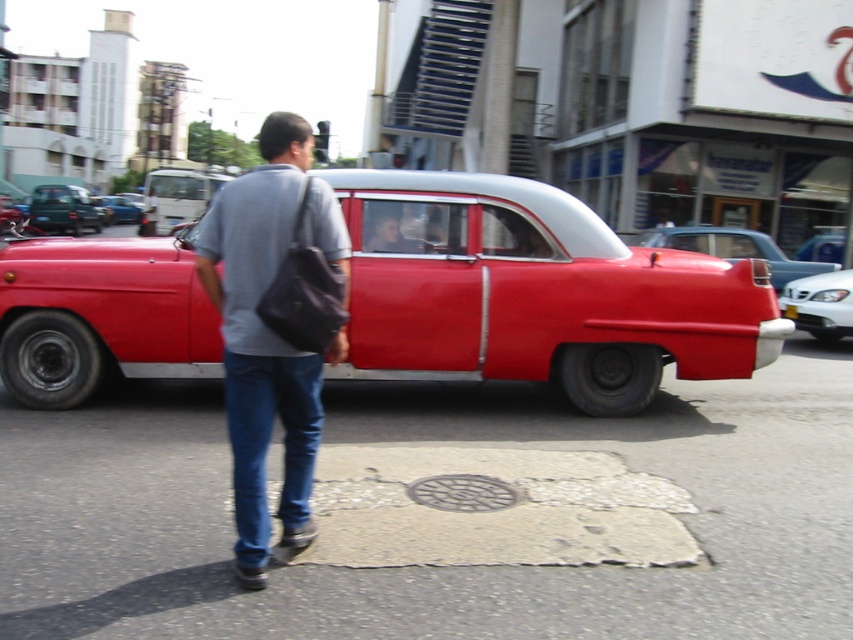
Question: Can you confirm if white glossy sedan at center is thinner than metallic blue car at center?

Choices:
 (A) no
 (B) yes

Answer: (B)

Question: Which object is farther from the camera taking this photo?

Choices:
 (A) shiny red car at center
 (B) white plastic license plate at center
 (C) white glossy sedan at center

Answer: (B)

Question: Does white glossy sedan at center have a greater width compared to metallic blue car at center?

Choices:
 (A) no
 (B) yes

Answer: (A)

Question: Among these points, which one is farthest from the camera?

Choices:
 (A) (796, 314)
 (B) (834, 292)
 (C) (119, 214)

Answer: (C)

Question: Which object appears farthest from the camera in this image?

Choices:
 (A) matte gray shirt at center
 (B) denim at left

Answer: (A)

Question: Is shiny red car at center positioned behind white glossy sedan at center?

Choices:
 (A) yes
 (B) no

Answer: (B)